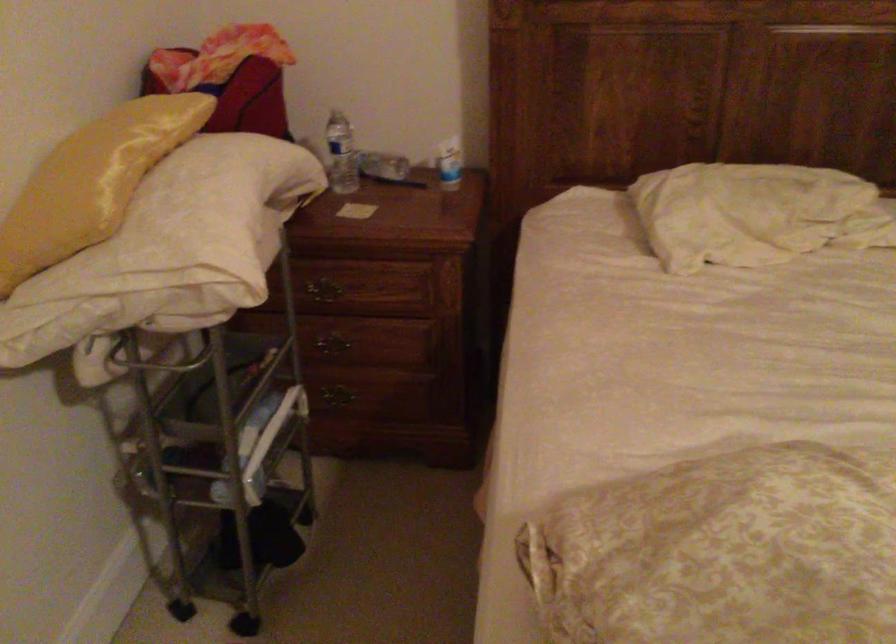
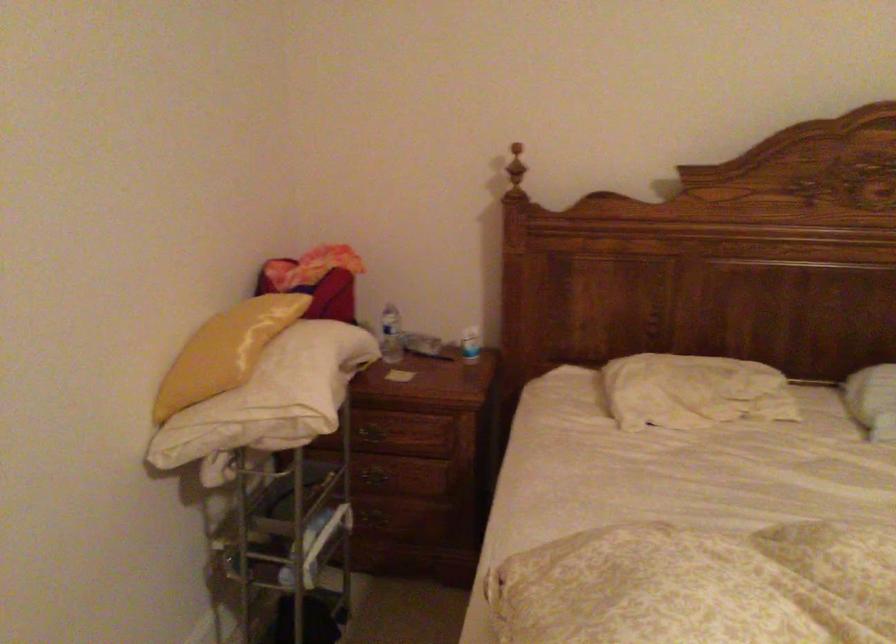
The point at (338, 156) is marked in the first image. Where is the corresponding point in the second image?

(391, 335)